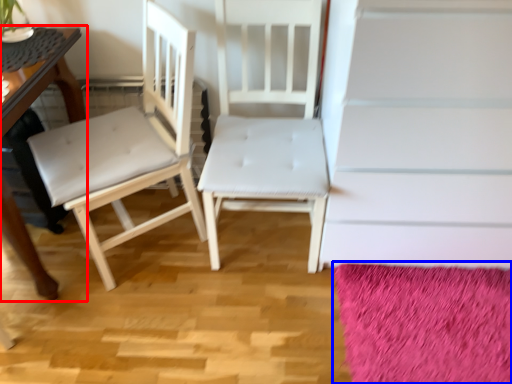
Question: Among these objects, which one is nearest to the camera, table (highlighted by a red box) or mat (highlighted by a blue box)?

Choices:
 (A) table
 (B) mat

Answer: (A)